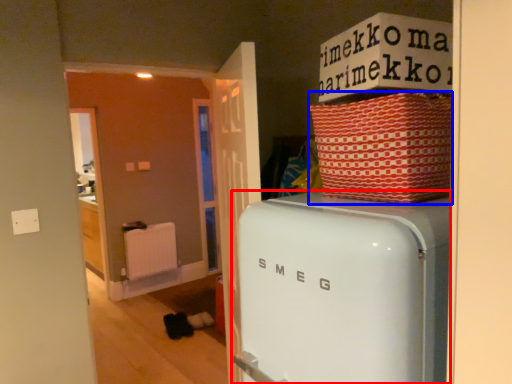
Question: Among these objects, which one is nearest to the camera, home appliance (highlighted by a red box) or crate (highlighted by a blue box)?

Choices:
 (A) home appliance
 (B) crate

Answer: (A)